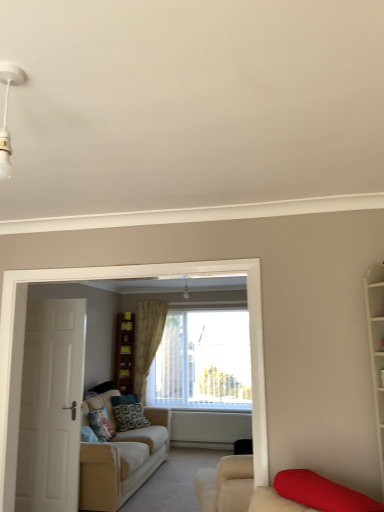
Question: Could you tell me if patterned fabric pillow at center, acting as the 1th pillow starting from the front, is facing brown wooden bookshelf at center?

Choices:
 (A) yes
 (B) no

Answer: (B)

Question: From the image's perspective, is patterned fabric pillow at center, acting as the 1th pillow starting from the front, located beneath brown wooden bookshelf at center?

Choices:
 (A) yes
 (B) no

Answer: (A)

Question: Is patterned fabric pillow at center, the second pillow from the back, to the right of brown wooden bookshelf at center from the viewer's perspective?

Choices:
 (A) yes
 (B) no

Answer: (A)

Question: Is brown wooden bookshelf at center inside patterned fabric pillow at center, the second pillow from the back?

Choices:
 (A) yes
 (B) no

Answer: (B)

Question: From a real-world perspective, is patterned fabric pillow at center, the second pillow from the back, beneath brown wooden bookshelf at center?

Choices:
 (A) no
 (B) yes

Answer: (B)

Question: From the image's perspective, is patterned fabric pillow at center, the second pillow from the back, positioned above or below white matte radiator at center?

Choices:
 (A) below
 (B) above

Answer: (B)

Question: Considering the relative positions of patterned fabric pillow at center, the second pillow from the back, and white matte radiator at center in the image provided, is patterned fabric pillow at center, the second pillow from the back, to the left or to the right of white matte radiator at center?

Choices:
 (A) right
 (B) left

Answer: (B)

Question: Considering the positions of patterned fabric pillow at center, acting as the 1th pillow starting from the front, and white matte radiator at center in the image, is patterned fabric pillow at center, acting as the 1th pillow starting from the front, bigger or smaller than white matte radiator at center?

Choices:
 (A) small
 (B) big

Answer: (A)

Question: Is point click(x=97, y=434) positioned closer to the camera than point click(x=211, y=429)?

Choices:
 (A) closer
 (B) farther

Answer: (A)

Question: Does point (3, 62) appear closer or farther from the camera than point (127, 347)?

Choices:
 (A) closer
 (B) farther

Answer: (A)

Question: Is white plastic light fixture at upper left taller or shorter than wooden bookshelf at center, the second shelf in the top-to-bottom sequence?

Choices:
 (A) short
 (B) tall

Answer: (B)

Question: Looking at their shapes, would you say white plastic light fixture at upper left is wider or thinner than wooden bookshelf at center, placed as the first shelf when sorted from bottom to top?

Choices:
 (A) thin
 (B) wide

Answer: (A)

Question: Relative to wooden bookshelf at center, the second shelf in the top-to-bottom sequence, is white plastic light fixture at upper left in front or behind?

Choices:
 (A) behind
 (B) front

Answer: (B)

Question: Considering the positions of point (370, 364) and point (145, 330), is point (370, 364) closer or farther from the camera than point (145, 330)?

Choices:
 (A) closer
 (B) farther

Answer: (A)

Question: Visually, is white wooden bookshelf at right positioned to the left or to the right of beige textured curtain at center?

Choices:
 (A) right
 (B) left

Answer: (A)